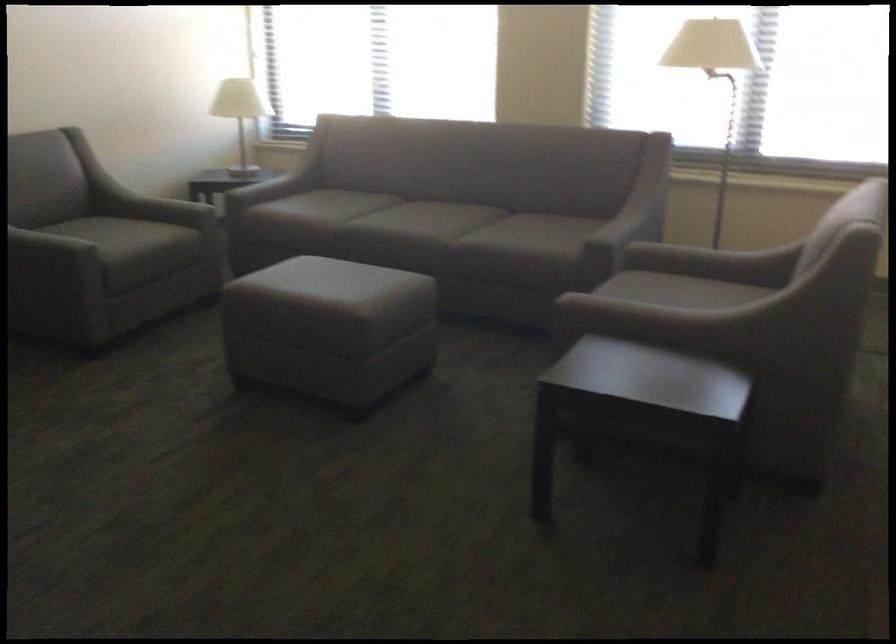
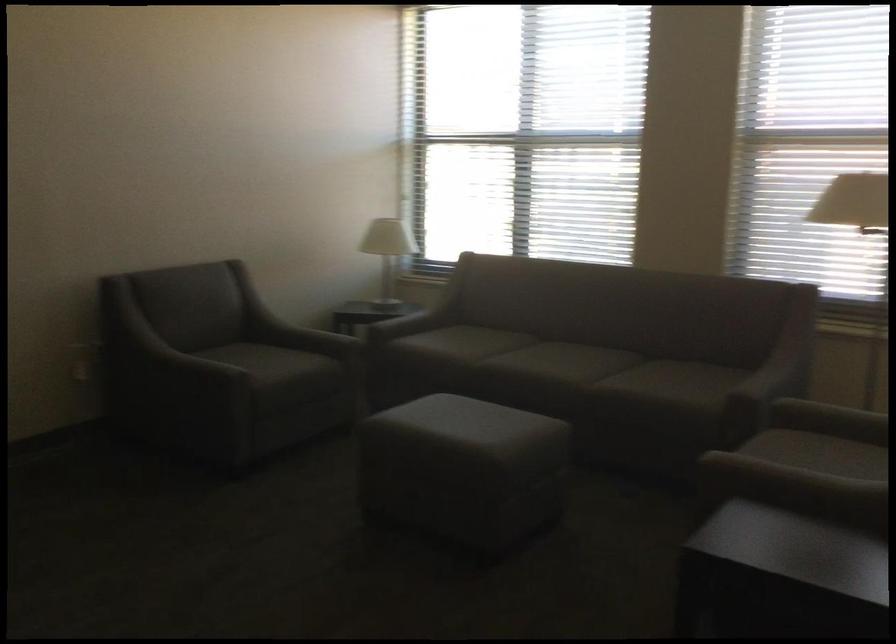
Find the pixel in the second image that matches the point at 444,230 in the first image.

(580, 373)